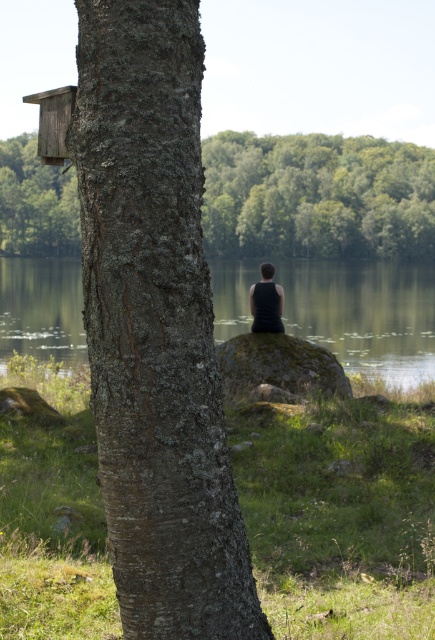
Between green water at center and green mossy rock at center, which one is positioned higher?

green water at center

Does point (294, 294) come behind point (267, 352)?

Yes, it is.

What do you see at coordinates (364, 314) in the screenshot? The height and width of the screenshot is (640, 435). I see `green water at center` at bounding box center [364, 314].

Locate an element on the screen. green water at center is located at coordinates (364, 314).

Is smooth bark tree trunk at left positioned behind wooden bird feeder at upper left?

No, it is not.

Is point (298, 164) more distant than point (62, 131)?

Yes, it is behind point (62, 131).

I want to click on smooth bark tree trunk at left, so click(x=317, y=196).

Does green mossy rock at center have a lesser width compared to wooden bird feeder at upper left?

No.

Between green mossy rock at center and wooden bird feeder at upper left, which one has more height?

green mossy rock at center

Is point (267, 339) in front of point (64, 156)?

No, (267, 339) is further to viewer.

Locate an element on the screen. The image size is (435, 640). green mossy rock at center is located at coordinates (278, 365).